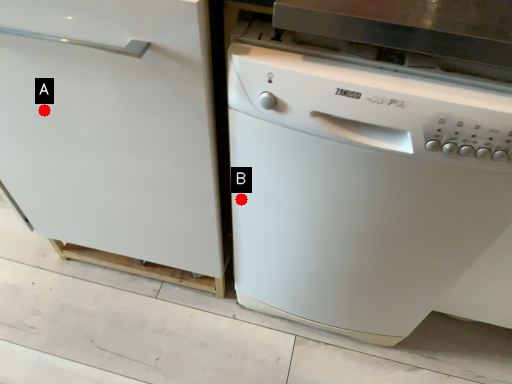
Question: Two points are circled on the image, labeled by A and B beside each circle. Which point is closer to the camera taking this photo?

Choices:
 (A) A is closer
 (B) B is closer

Answer: (A)